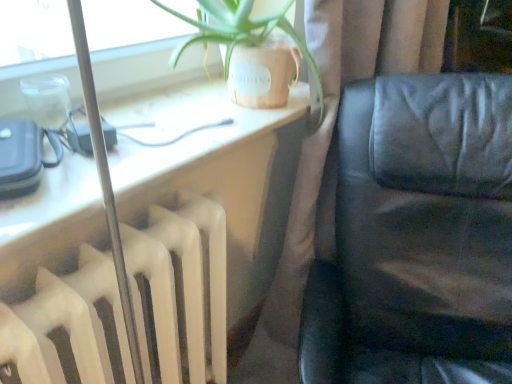
Question: Based on their positions, is black leather couch at right located to the left or right of brown fabric curtain at center?

Choices:
 (A) left
 (B) right

Answer: (B)

Question: Considering the positions of black leather couch at right and brown fabric curtain at center in the image, is black leather couch at right bigger or smaller than brown fabric curtain at center?

Choices:
 (A) big
 (B) small

Answer: (A)

Question: Which is nearer to the matte black leather couch at right?

Choices:
 (A) white matte radiator at left
 (B) brown fabric curtain at center
 (C) black leather couch at right

Answer: (A)

Question: Considering the real-world distances, which object is closest to the black leather couch at right?

Choices:
 (A) matte black leather couch at right
 (B) brown fabric curtain at center
 (C) white matte radiator at left

Answer: (B)